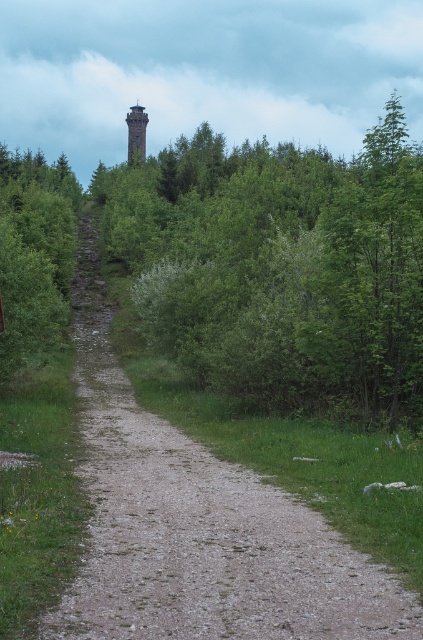
Question: Where is green leafy forest at upper center located in relation to smooth stone tower at upper center in the image?

Choices:
 (A) right
 (B) left

Answer: (A)

Question: Is green leafy forest at upper center to the right of dirt/gravel path at center from the viewer's perspective?

Choices:
 (A) no
 (B) yes

Answer: (A)

Question: Which object appears closest to the camera in this image?

Choices:
 (A) dirt/gravel path at center
 (B) smooth stone tower at upper center

Answer: (A)

Question: Can you confirm if green leafy forest at upper center is positioned above smooth stone tower at upper center?

Choices:
 (A) yes
 (B) no

Answer: (B)

Question: Which of the following is the farthest from the observer?

Choices:
 (A) (145, 125)
 (B) (123, 282)

Answer: (A)

Question: Which of the following is the farthest from the observer?

Choices:
 (A) (332, 218)
 (B) (271, 532)
 (C) (137, 160)

Answer: (C)